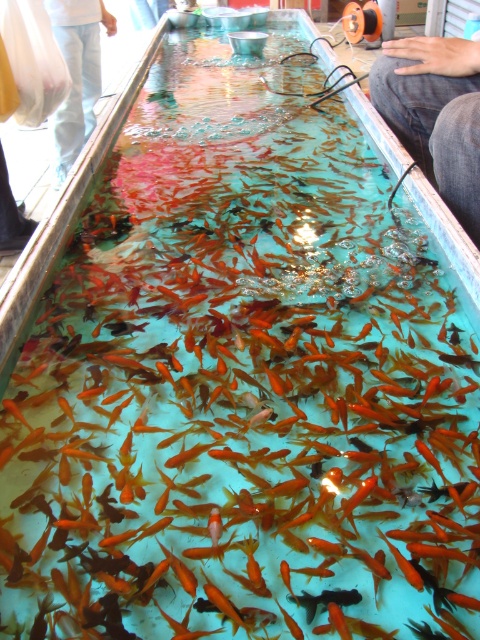
You are a person who is 1.7 meters tall. You are standing in front of the tank and want to reach both the jeans at center and the white cotton pants at upper left. Can you touch both items without moving your position?

The jeans at center and white cotton pants at upper left are 1.86 meters apart from each other. Since you are only 1.7 meters tall, you cannot stretch your arms far enough to touch both items simultaneously without moving your position.

You are standing in front of the tank and notice two items outside the tank. The jeans at center and the white cotton pants at upper left. Which item is shorter?

The jeans at center is not as tall as white cotton pants at upper left, so the jeans at center is shorter.